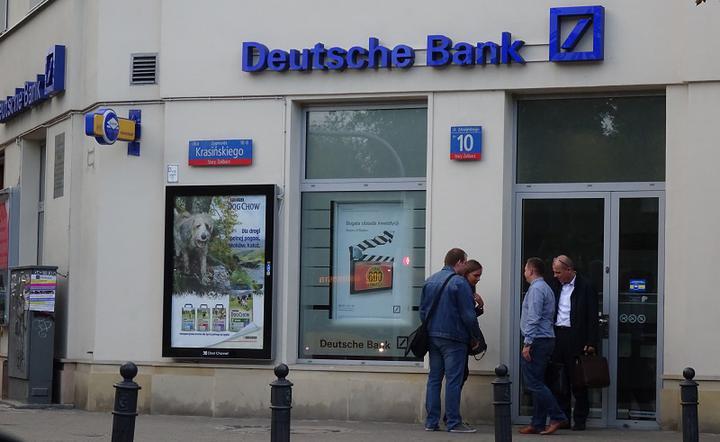
Image resolution: width=720 pixels, height=442 pixels. What are the coordinates of `poster` in the screenshot? It's located at (224, 267).